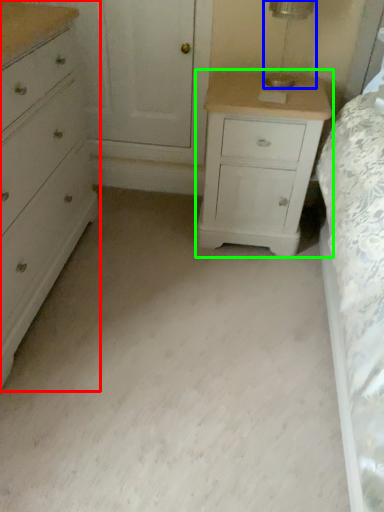
Question: Based on their relative distances, which object is farther from chest of drawers (highlighted by a red box)? Choose from table lamp (highlighted by a blue box) and nightstand (highlighted by a green box).

Choices:
 (A) table lamp
 (B) nightstand

Answer: (A)